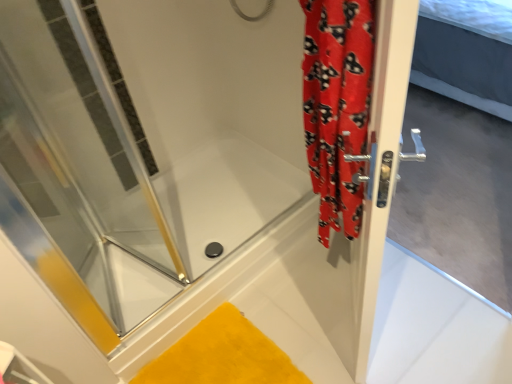
Question: Is red fabric shower curtain at right taller than transparent glass shower door at left?

Choices:
 (A) no
 (B) yes

Answer: (A)

Question: From a real-world perspective, is red fabric shower curtain at right located beneath transparent glass shower door at left?

Choices:
 (A) yes
 (B) no

Answer: (B)

Question: Is red fabric shower curtain at right at the right side of transparent glass shower door at left?

Choices:
 (A) yes
 (B) no

Answer: (A)

Question: Considering the relative positions of red fabric shower curtain at right and transparent glass shower door at left in the image provided, is red fabric shower curtain at right behind transparent glass shower door at left?

Choices:
 (A) no
 (B) yes

Answer: (A)

Question: Is transparent glass shower door at left surrounded by red fabric shower curtain at right?

Choices:
 (A) yes
 (B) no

Answer: (B)

Question: Is red fabric shower curtain at right bigger than transparent glass shower door at left?

Choices:
 (A) no
 (B) yes

Answer: (B)

Question: From a real-world perspective, does transparent glass shower door at left stand above yellow plush bath mat at lower center?

Choices:
 (A) no
 (B) yes

Answer: (B)

Question: From the image's perspective, does transparent glass shower door at left appear higher than yellow plush bath mat at lower center?

Choices:
 (A) no
 (B) yes

Answer: (B)

Question: Does transparent glass shower door at left have a greater width compared to yellow plush bath mat at lower center?

Choices:
 (A) yes
 (B) no

Answer: (A)

Question: Does transparent glass shower door at left come behind yellow plush bath mat at lower center?

Choices:
 (A) yes
 (B) no

Answer: (B)

Question: Does transparent glass shower door at left come in front of yellow plush bath mat at lower center?

Choices:
 (A) no
 (B) yes

Answer: (B)

Question: Is transparent glass shower door at left far away from yellow plush bath mat at lower center?

Choices:
 (A) yes
 (B) no

Answer: (B)

Question: Considering the relative sizes of red fabric shower curtain at right and silver metallic door handle at right in the image provided, is red fabric shower curtain at right bigger than silver metallic door handle at right?

Choices:
 (A) yes
 (B) no

Answer: (B)